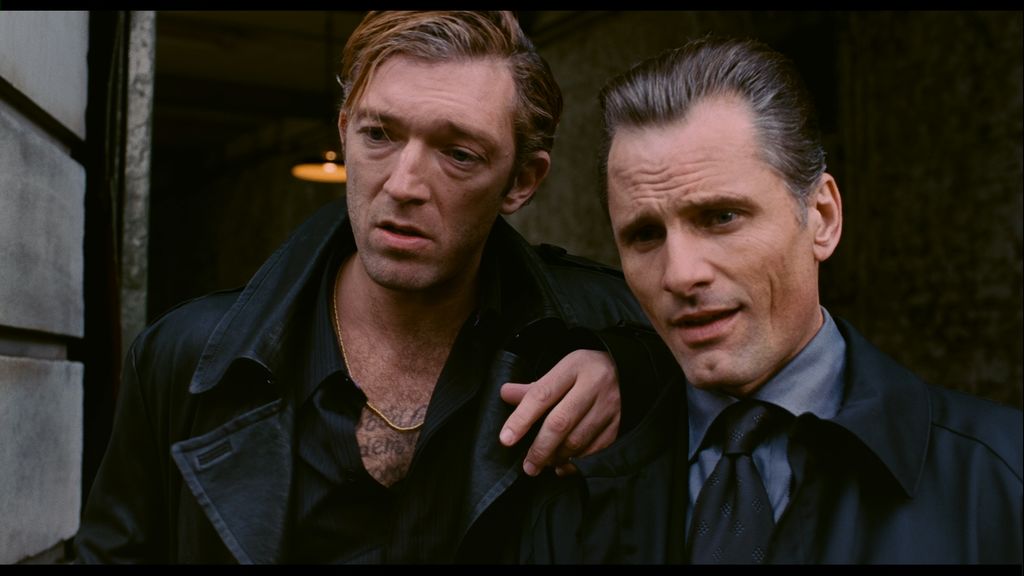
Find the location of `light`. light is located at coordinates (562, 218), (332, 168).